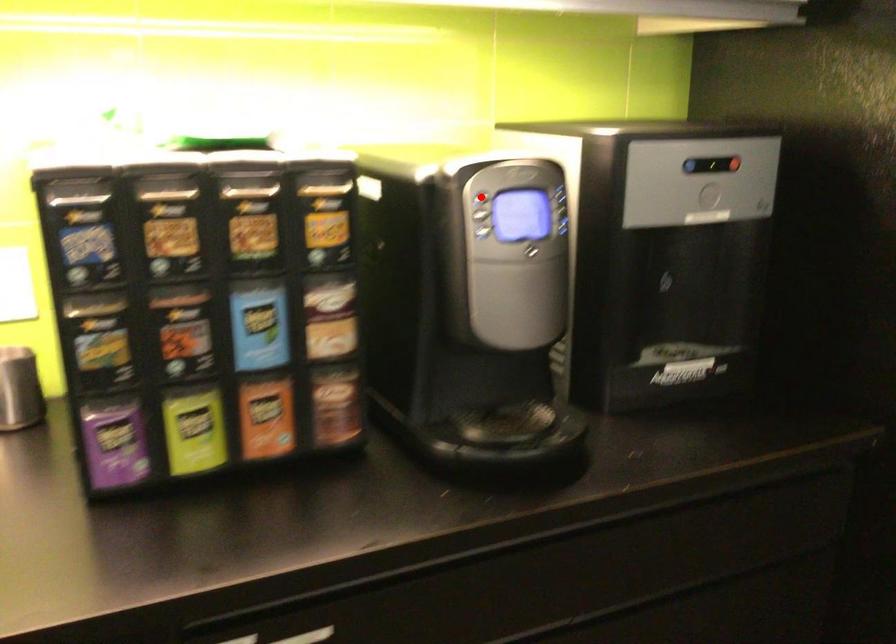
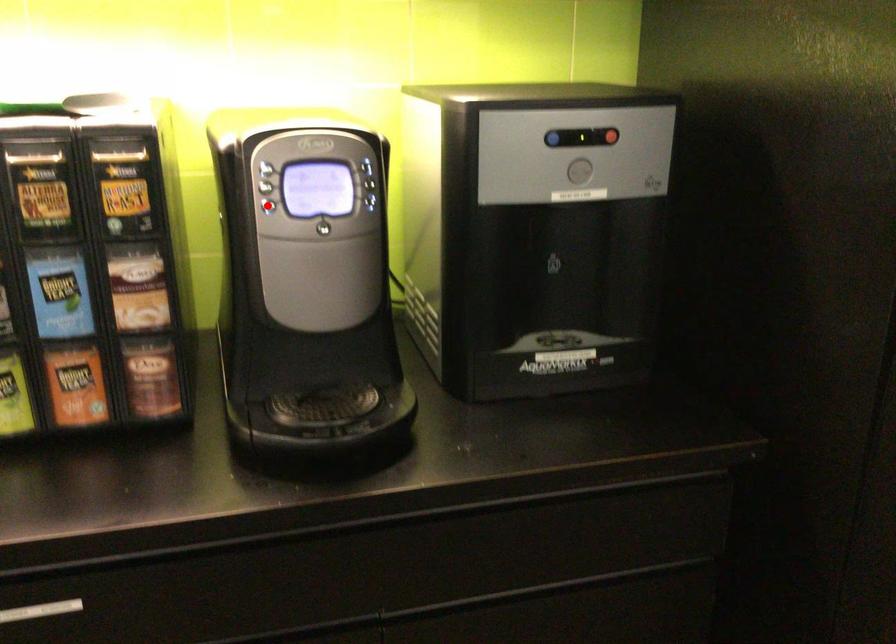
I am providing you with two images of the same scene from different viewpoints. A red point is marked on the first image and another point is marked on the second image. Is the marked point in image1 the same physical position as the marked point in image2?

No